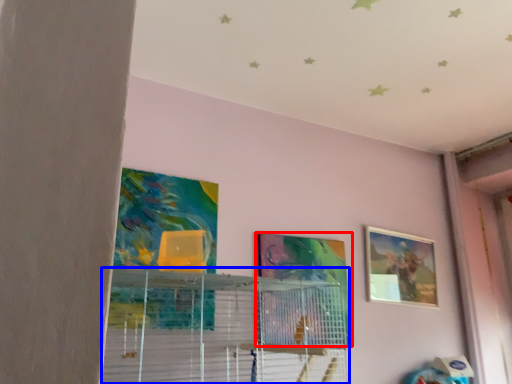
Question: Among these objects, which one is nearest to the camera, picture frame (highlighted by a red box) or shelf (highlighted by a blue box)?

Choices:
 (A) picture frame
 (B) shelf

Answer: (B)